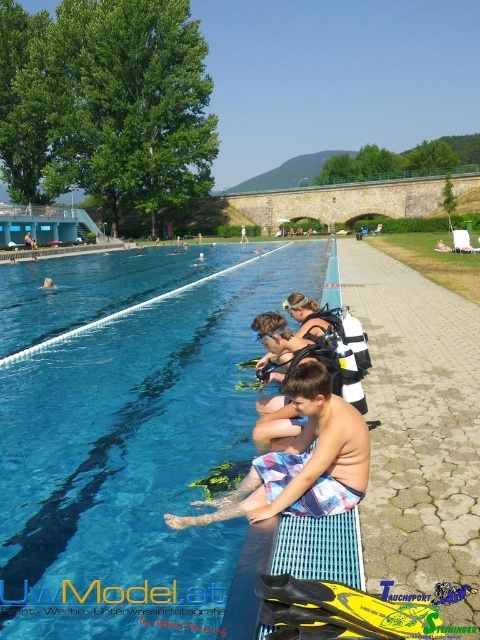
Consider the image. You are a lifeguard standing at the edge of the pool. You notice the blue smooth water at center and the multicolored swim trunks at lower center. Which object is taller from your viewpoint?

The blue smooth water at center is taller than the multicolored swim trunks at lower center according to the description.

You are a lifeguard standing at the edge of the pool. You need to reach the multicolored swim trunks at lower center quickly. The pool is 30 feet wide. Can you safely jump into the blue smooth water at center to retrieve them without entering the deep end?

The blue smooth water at center is 32.95 feet from the multicolored swim trunks at lower center. Since the pool is only 30 feet wide, jumping into the blue smooth water at center would require crossing the entire pool width, which might lead to entering the deep end. Therefore, it is not safe to jump into the blue smooth water at center to retrieve the multicolored swim trunks at lower center.

You are a photographer trying to capture a photo of the blue smooth water at center and the multicolored swim trunks at lower center. Since you want to focus on the larger object, which one should you point your camera at?

The blue smooth water at center is bigger than the multicolored swim trunks at lower center, so you should point your camera at the blue smooth water at center to focus on the larger object.